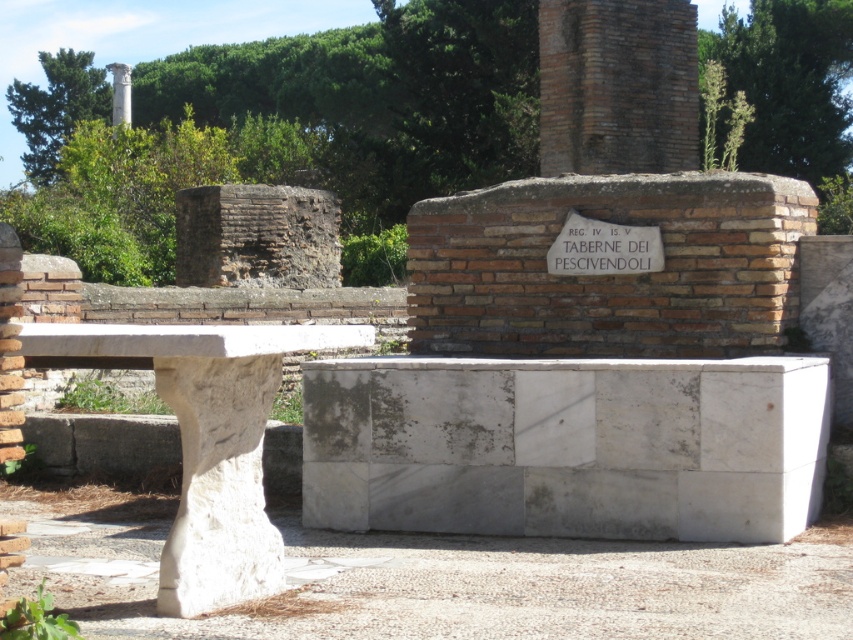
You are an archaeologist examining the site. You notice the brown brick column at upper center and the white stone column at upper left. Which column is located lower in the image?

The brown brick column at upper center is positioned under the white stone column at upper left, so it is located lower in the image.

You are an archaeologist examining the site. You notice two columns in the image. Which column is shorter between the brown brick column at upper center and the white stone column at upper left?

The brown brick column at upper center is shorter than the white stone column at upper left.